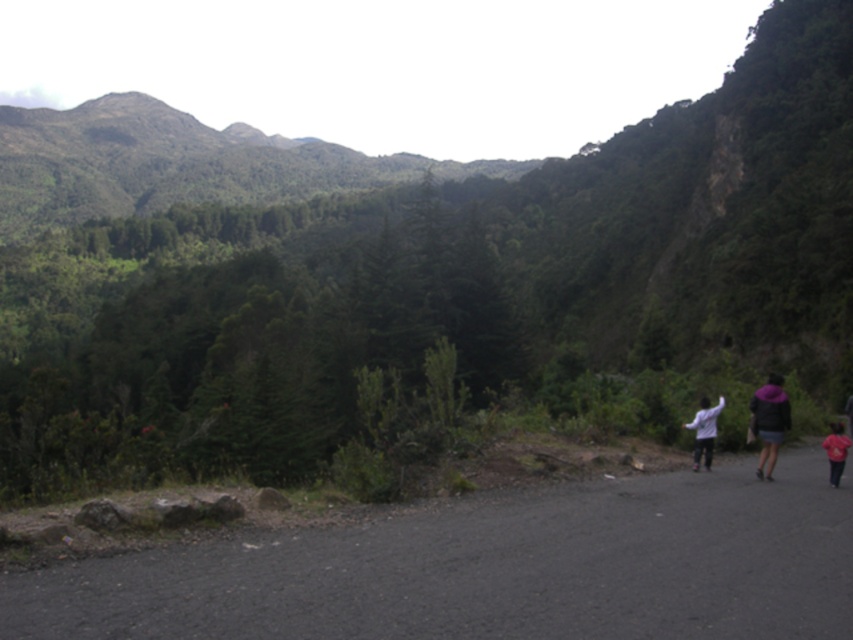
You are standing at the starting point of the road and want to locate the purple fuzzy jacket at right. According to the coordinates provided, where should you look relative to your current position?

The purple fuzzy jacket at right is located at coordinates point (x=769, y=420), which means it is positioned to the right and slightly forward from your current position on the road.

You are a photographer standing at the start of the road. You want to take a photo of the purple fuzzy jacket at right and the red cotton shirt at right so that both are clearly visible in the frame. Considering the distance between them, what is the minimum focal length lens you should use if your camera has a sensor size of 24mm x 36mm and you want to capture both subjects without distortion?

The purple fuzzy jacket at right and red cotton shirt at right are 3.73 meters apart. To capture both subjects clearly without distortion, you should use a wide angle lens with a focal length between 24mm to 35mm. This range ensures the entire distance between them fits into the frame while minimizing distortion.